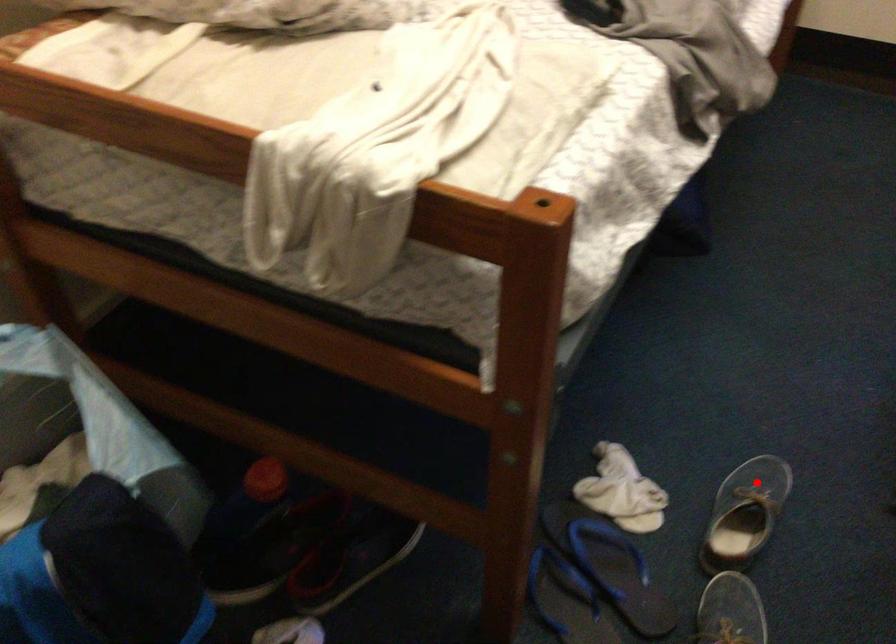
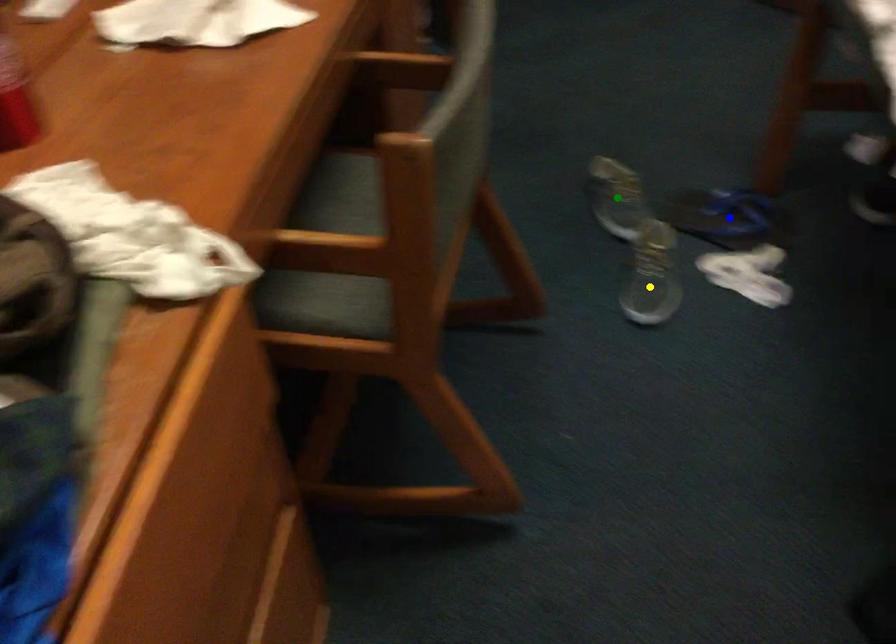
Question: I am providing you with two images of the same scene from different viewpoints. A red point is marked on the first image. You are given multiple points on the second image. Can you choose the point in image 2 that corresponds to the point in image 1?

Choices:
 (A) blue point
 (B) yellow point
 (C) green point

Answer: (B)